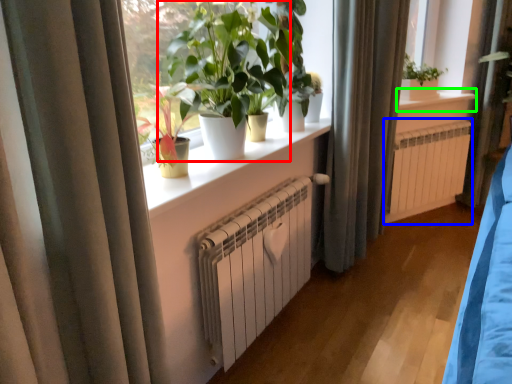
Question: Which object is the closest to the houseplant (highlighted by a red box)? Choose among these: air conditioning (highlighted by a blue box) or window sill (highlighted by a green box).

Choices:
 (A) air conditioning
 (B) window sill

Answer: (A)